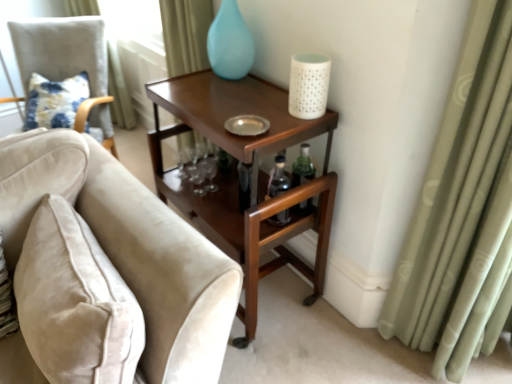
This screenshot has width=512, height=384. In order to click on vacant space in front of matte blue glass vase at upper center in this screenshot , I will do `click(240, 92)`.